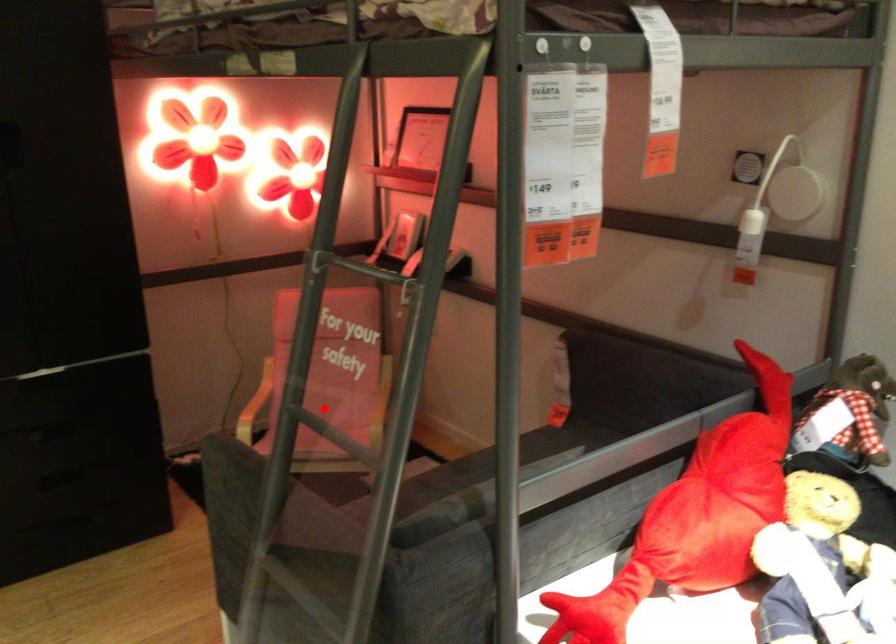
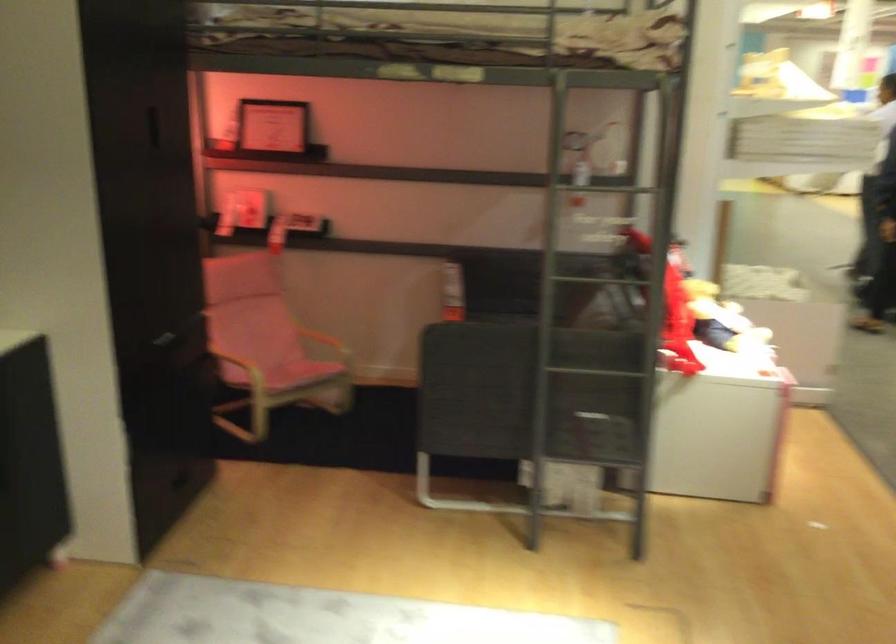
Question: I am providing you with two images of the same scene from different viewpoints. In image1, a red point is highlighted. Considering the same 3D point in image2, which of the following is correct?

Choices:
 (A) It is closer
 (B) It is farther

Answer: (B)